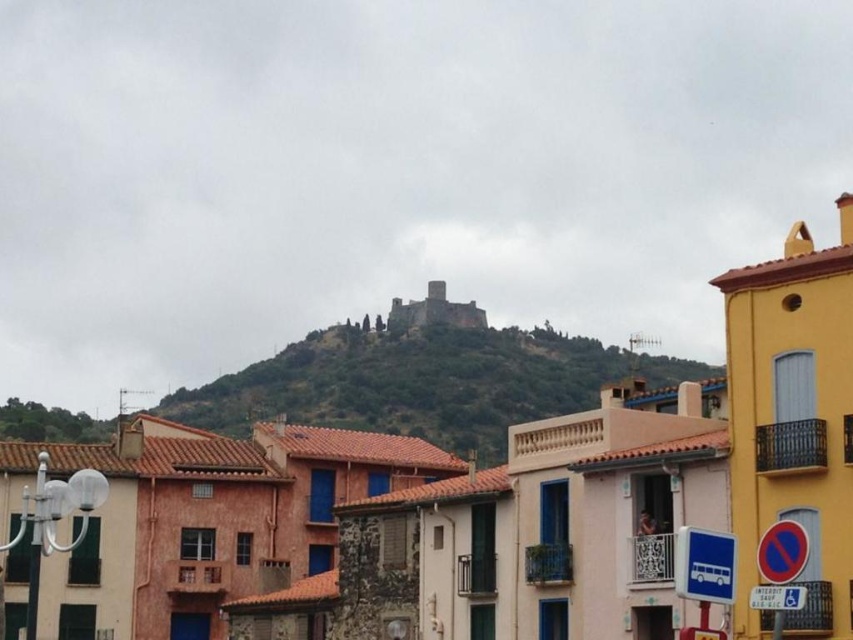
You are standing in the town square and want to take a photo of the terracotta clay roof tiles at upper center and the green grassy hillside at center. Which object should you focus on first to ensure both are in clear view?

You should focus on the terracotta clay roof tiles at upper center first because it is closer to the viewer than the green grassy hillside at center, so focusing on the closer object will help keep both in focus.

You are an architect analyzing the town layout. You observe the terracotta clay roof tiles at upper center and the green grassy hillside at center. Which of these two elements occupies a larger area in the scene?

The green grassy hillside at center occupies a larger area than the terracotta clay roof tiles at upper center because the terracotta clay roof tiles at upper center is smaller than green grassy hillside at center.